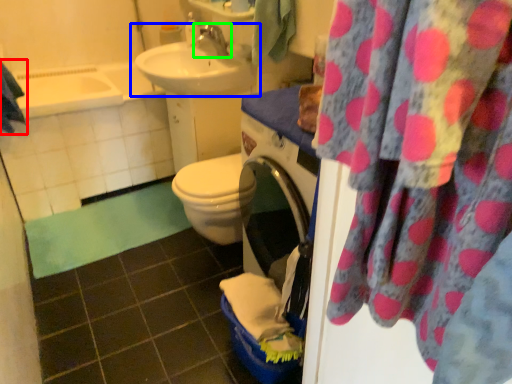
Question: Estimate the real-world distances between objects in this image. Which object is farther from beach towel (highlighted by a red box), sink (highlighted by a blue box) or tap (highlighted by a green box)?

Choices:
 (A) sink
 (B) tap

Answer: (B)